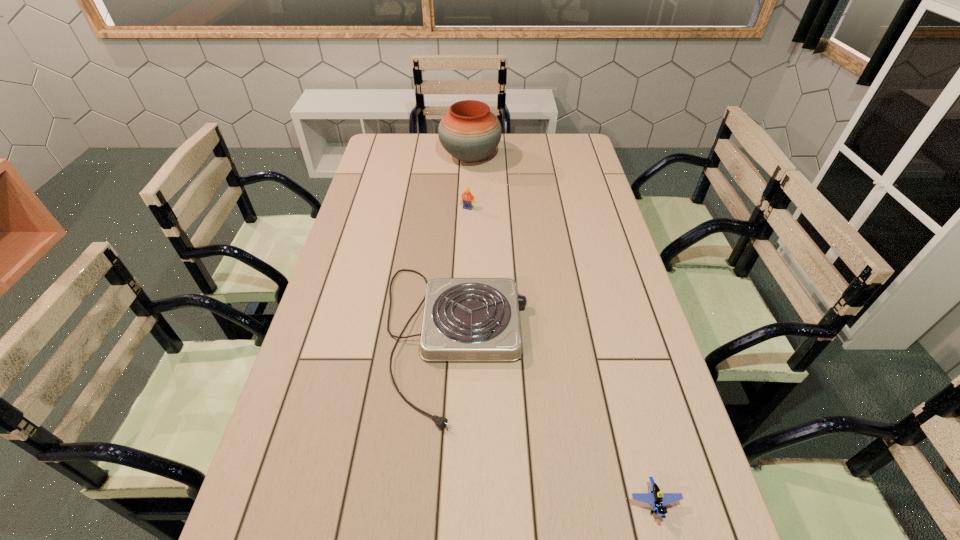
Image resolution: width=960 pixels, height=540 pixels. Identify the location of the tallest object. click(x=469, y=132).

In order to click on the farthest object in this screenshot , I will do `click(469, 132)`.

Identify the location of the second tallest object. (x=467, y=198).

The height and width of the screenshot is (540, 960). What are the coordinates of `the second farthest object` in the screenshot? It's located at (467, 198).

Identify the location of the second nearest object. The height and width of the screenshot is (540, 960). (465, 319).

I want to click on the nearest object, so coord(655,497).

The image size is (960, 540). Identify the location of the nearer Lego. (655, 497).

Find the location of a particular element. vacant space situated 0.120m on the front of the tallest object is located at coordinates (469, 191).

The image size is (960, 540). In order to click on free space located on the front-facing side of the second tallest object in this screenshot , I will do `click(467, 237)`.

Locate an element on the screen. This screenshot has height=540, width=960. vacant space located with a retractable cable on the side of the second nearest object is located at coordinates (562, 339).